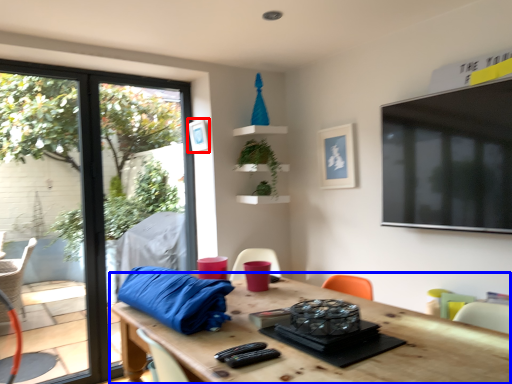
Question: Which of the following is the farthest to the observer, picture frame (highlighted by a red box) or table (highlighted by a blue box)?

Choices:
 (A) picture frame
 (B) table

Answer: (A)